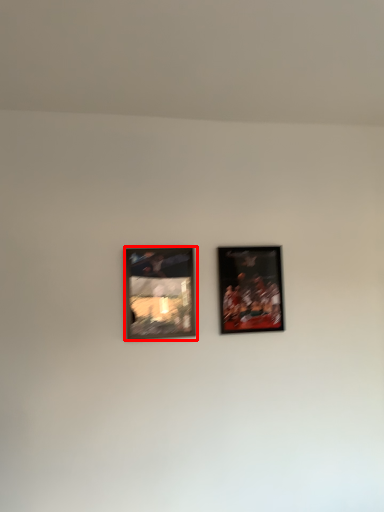
Question: Where is picture frame (annotated by the red box) located in relation to picture frame in the image?

Choices:
 (A) right
 (B) left

Answer: (B)